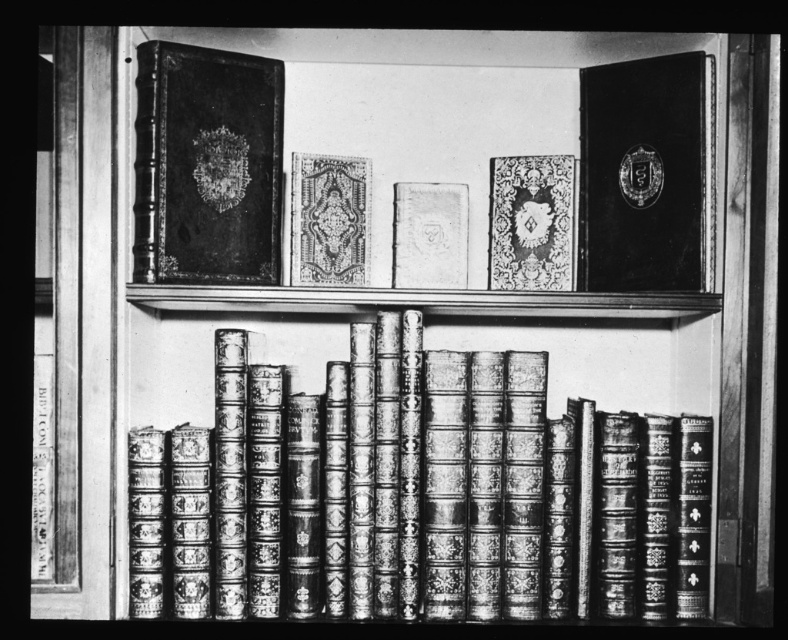
You are a librarian who needs to place a new book between the matte black book at upper left and the shiny black book at upper right. Based on their positions, which book should you place the new book closer to if you want it to appear closer to the viewer?

You should place the new book closer to the matte black book at upper left because it is already closer to the viewer than the shiny black book at upper right.

You are organizing a library and need to place a new book that requires a shelf space taller than 12 inches. Looking at the matte black book at upper left and the shiny black book at upper right, which one can accommodate the new book if the shelf height must be greater than 12 inches?

The shiny black book at upper right is taller than the matte black book at upper left. Since the shelf height must be greater than 12 inches, the shiny black book at upper right can accommodate the new book if its height meets the requirement.